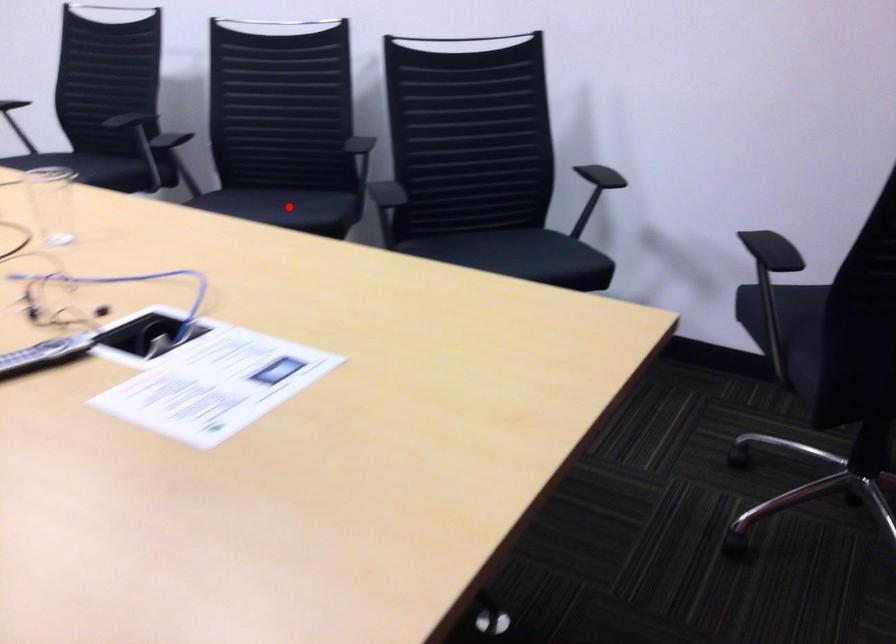
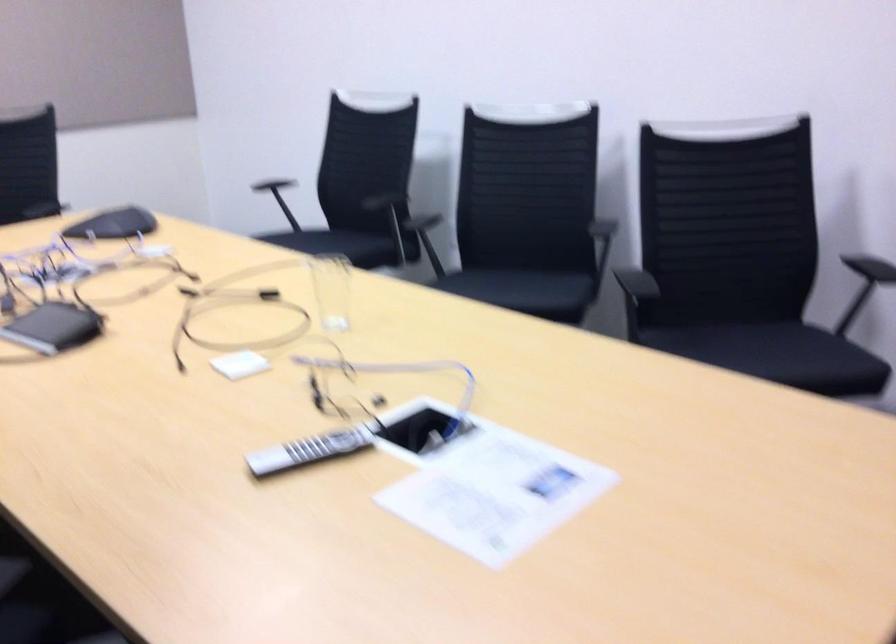
The point at the highlighted location is marked in the first image. Where is the corresponding point in the second image?

(528, 289)